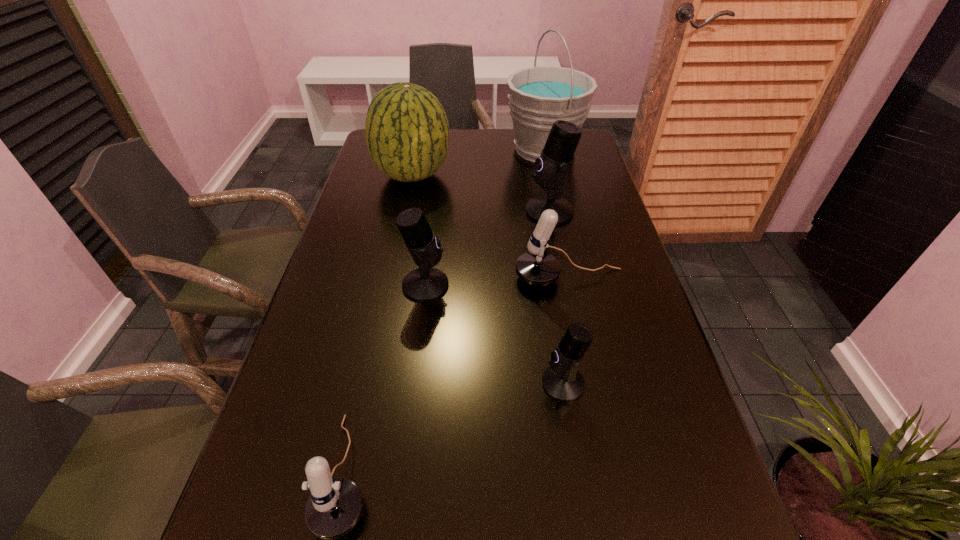
You are a GUI agent. You are given a task and a screenshot of the screen. Output one action in this format:
    pyautogui.click(x=<x>, y=<y>)
    Task: Click on the free space between the bigger white microphone and the farthest black microphone
    The image size is (960, 540).
    Given the screenshot: What is the action you would take?
    (x=559, y=245)

The width and height of the screenshot is (960, 540). Identify the location of free spot between the second biggest black microphone and the bigger white microphone. (497, 282).

Identify the location of vacant area that lies between the sixth farthest object and the watermelon. This screenshot has height=540, width=960. (488, 279).

I want to click on vacant point located between the tallest microphone and the watermelon, so click(x=481, y=193).

This screenshot has width=960, height=540. In order to click on vacant area that lies between the watermelon and the farther white microphone in this screenshot , I will do `click(491, 227)`.

The height and width of the screenshot is (540, 960). I want to click on object that is the closest one to the second biggest black microphone, so click(x=536, y=267).

The width and height of the screenshot is (960, 540). Identify the location of object that ranks as the second closest to the tallest object. 407,133.

Locate which microphone is the third closest to the second nearest black microphone. Please provide its 2D coordinates. Your answer should be formatted as a tuple, i.e. [(x, y)], where the tuple contains the x and y coordinates of a point satisfying the conditions above.

[(551, 167)]

Select which microphone is the second closest to the right white microphone. Please provide its 2D coordinates. Your answer should be formatted as a tuple, i.e. [(x, y)], where the tuple contains the x and y coordinates of a point satisfying the conditions above.

[(424, 284)]

Choose which black microphone is the nearest neighbor to the second biggest black microphone. Please provide its 2D coordinates. Your answer should be formatted as a tuple, i.e. [(x, y)], where the tuple contains the x and y coordinates of a point satisfying the conditions above.

[(562, 381)]